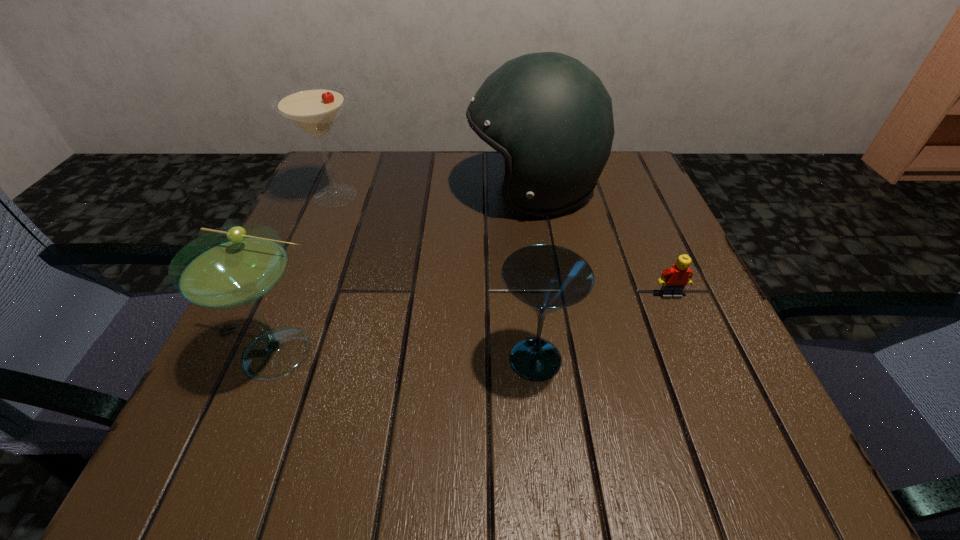
At what (x,y) coordinates should I click in order to perform the action: click on free space that satisfies the following two spatial constraints: 1. on the front side of the rightmost martini; 2. on the left side of the farthest martini. Please return your answer as a coordinate pair (x, y). The width and height of the screenshot is (960, 540). Looking at the image, I should click on (268, 359).